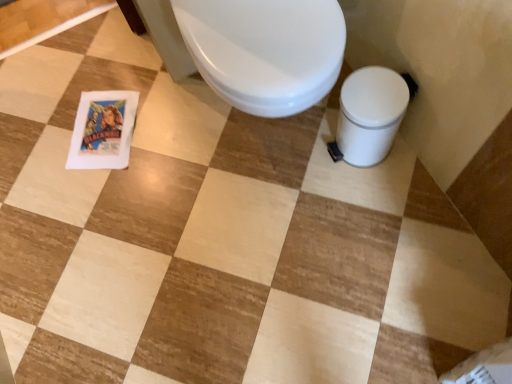
Identify the location of vacant area on top of white glossy toilet bowl at lower right (from a real-world perspective). This screenshot has width=512, height=384. (375, 95).